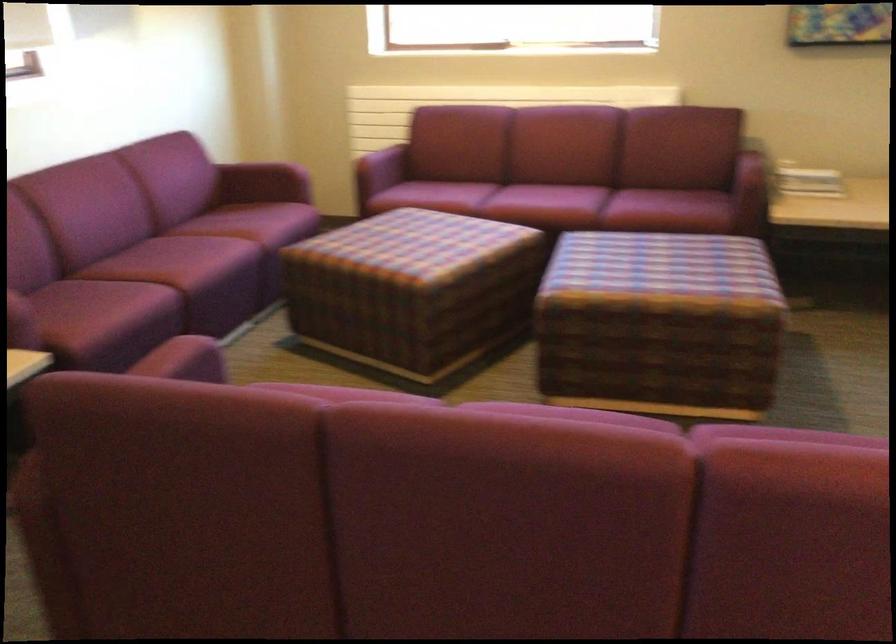
At what (x,y) coordinates should I click in order to perform the action: click on stack of papers. Please return your answer as a coordinate pair (x, y). The height and width of the screenshot is (644, 896). Looking at the image, I should click on (807, 180).